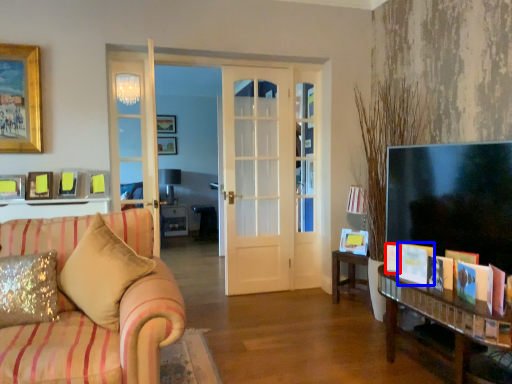
Question: Which object appears closest to the camera in this image, book (highlighted by a red box) or book (highlighted by a blue box)?

Choices:
 (A) book
 (B) book

Answer: (B)